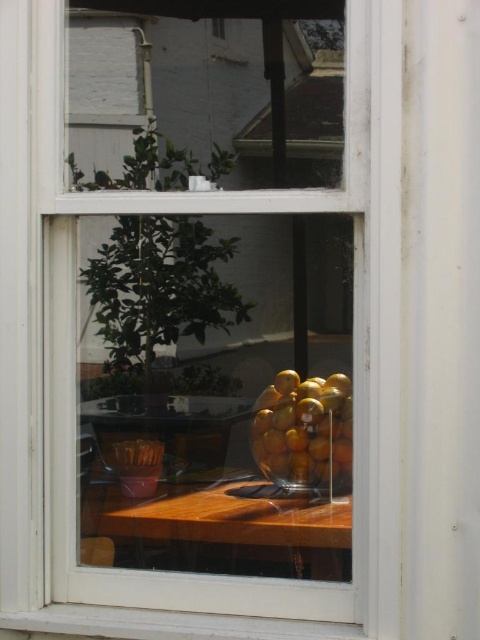
Question: Can you confirm if wooden table at center is positioned to the right of shiny golden fruit at center?

Choices:
 (A) yes
 (B) no

Answer: (B)

Question: Does wooden table at center appear over shiny golden fruit at center?

Choices:
 (A) yes
 (B) no

Answer: (B)

Question: Does wooden table at center appear under shiny golden fruit at center?

Choices:
 (A) yes
 (B) no

Answer: (A)

Question: Among these points, which one is farthest from the camera?

Choices:
 (A) (300, 502)
 (B) (283, 458)

Answer: (B)